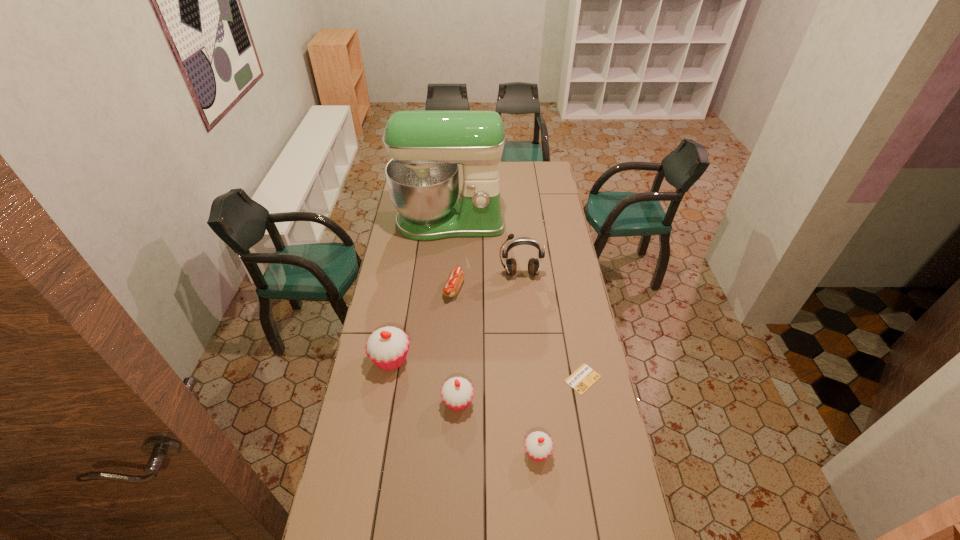
Where is `the farthest cupcake`? The height and width of the screenshot is (540, 960). the farthest cupcake is located at coordinates (387, 347).

Image resolution: width=960 pixels, height=540 pixels. I want to click on the leftmost cupcake, so click(387, 347).

Where is `the second cupcake from right to left`? The height and width of the screenshot is (540, 960). the second cupcake from right to left is located at coordinates (457, 393).

At what (x,y) coordinates should I click in order to perform the action: click on the second farthest cupcake. Please return your answer as a coordinate pair (x, y). The image size is (960, 540). Looking at the image, I should click on (457, 393).

The height and width of the screenshot is (540, 960). I want to click on the shortest cupcake, so click(x=538, y=445).

You are a GUI agent. You are given a task and a screenshot of the screen. Output one action in this format:
    pyautogui.click(x=<x>, y=<y>)
    Task: Click on the third shortest object
    
    Given the screenshot: What is the action you would take?
    pyautogui.click(x=538, y=445)

This screenshot has width=960, height=540. What are the coordinates of `mixer` in the screenshot? It's located at (426, 147).

Where is `the tallest object`? the tallest object is located at coordinates (426, 147).

You are a GUI agent. You are given a task and a screenshot of the screen. Output one action in this format:
    pyautogui.click(x=<x>, y=<y>)
    Task: Click on the second shortest object
    The image size is (960, 540).
    Given the screenshot: What is the action you would take?
    pyautogui.click(x=456, y=277)

The width and height of the screenshot is (960, 540). I want to click on earphone, so click(510, 266).